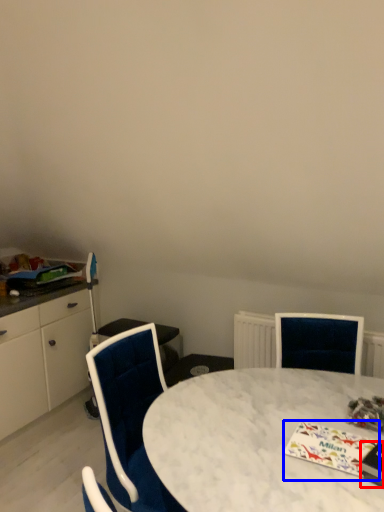
Question: Which object appears closest to the camera in this image, magazine (highlighted by a red box) or magazine (highlighted by a blue box)?

Choices:
 (A) magazine
 (B) magazine

Answer: (A)